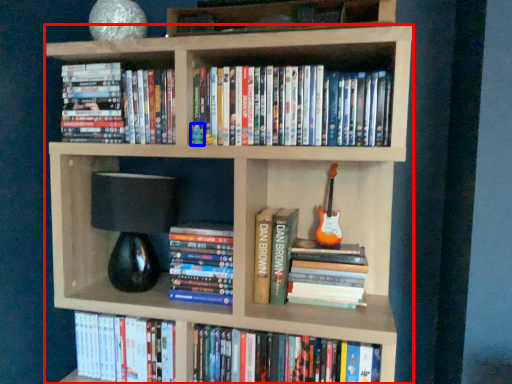
Question: Among these objects, which one is farthest to the camera, bookcase (highlighted by a red box) or toy (highlighted by a blue box)?

Choices:
 (A) bookcase
 (B) toy

Answer: (B)